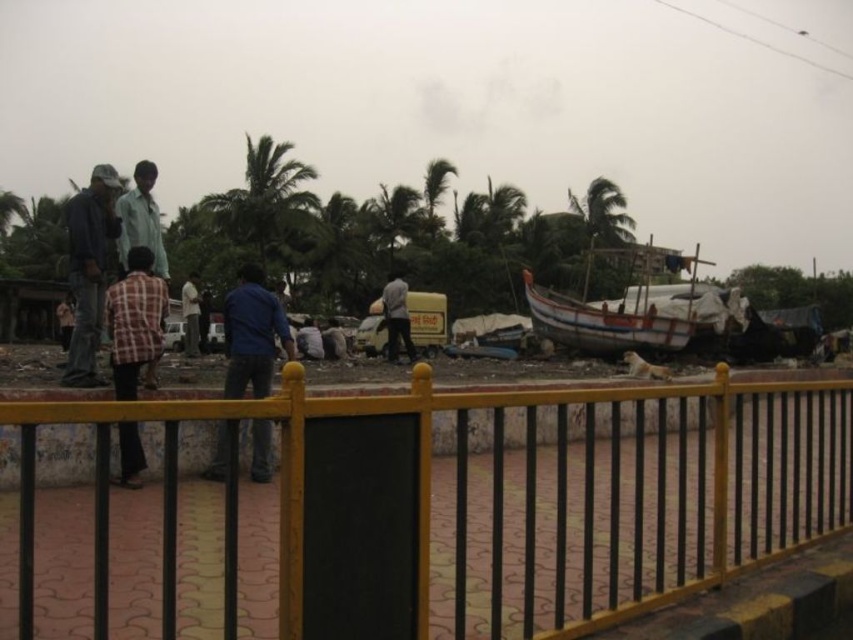
Does wooden boat at center have a larger size compared to plaid fabric shirt at lower left?

Correct, wooden boat at center is larger in size than plaid fabric shirt at lower left.

Locate an element on the screen. The height and width of the screenshot is (640, 853). wooden boat at center is located at coordinates (619, 307).

Is point (708, 339) in front of point (125, 276)?

That is False.

Image resolution: width=853 pixels, height=640 pixels. Identify the location of wooden boat at center. (619, 307).

Is point (256, 372) more distant than point (190, 353)?

No, (256, 372) is in front of (190, 353).

Who is more distant from viewer, (265, 326) or (190, 291)?

Positioned behind is point (190, 291).

The width and height of the screenshot is (853, 640). Identify the location of blue denim jeans at center. point(252,333).

Describe the element at coordinates (491, 497) in the screenshot. Image resolution: width=853 pixels, height=640 pixels. I see `yellow metal fence at center` at that location.

Is point (502, 529) positioned after point (189, 333)?

No, (502, 529) is in front of (189, 333).

Does point (534, 397) come closer to viewer compared to point (183, 298)?

Yes, point (534, 397) is closer to viewer.

Find the location of a particular element. The width and height of the screenshot is (853, 640). yellow metal fence at center is located at coordinates (491, 497).